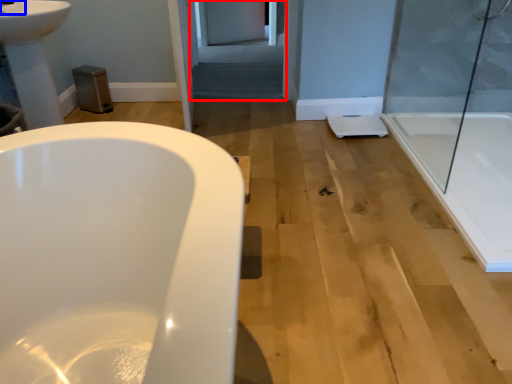
Question: Which object appears closest to the camera in this image, screen door (highlighted by a red box) or faucet (highlighted by a blue box)?

Choices:
 (A) screen door
 (B) faucet

Answer: (B)